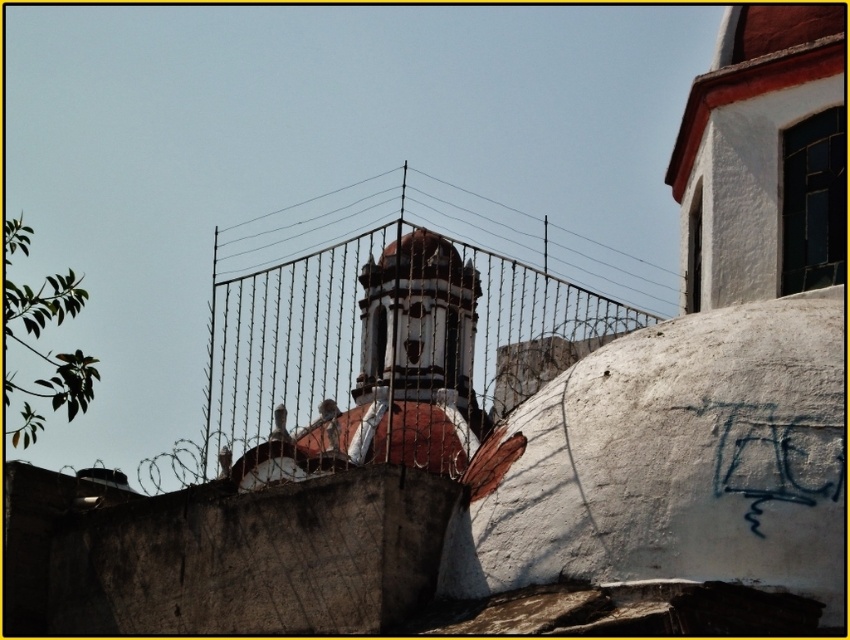
From the picture: Is metallic wire fence at center closer to the viewer compared to blue graffiti at center-right?

No, metallic wire fence at center is behind blue graffiti at center-right.

Is point (318, 403) behind point (751, 515)?

Yes, point (318, 403) is behind point (751, 515).

The image size is (850, 640). What are the coordinates of `metallic wire fence at center` in the screenshot? It's located at (384, 348).